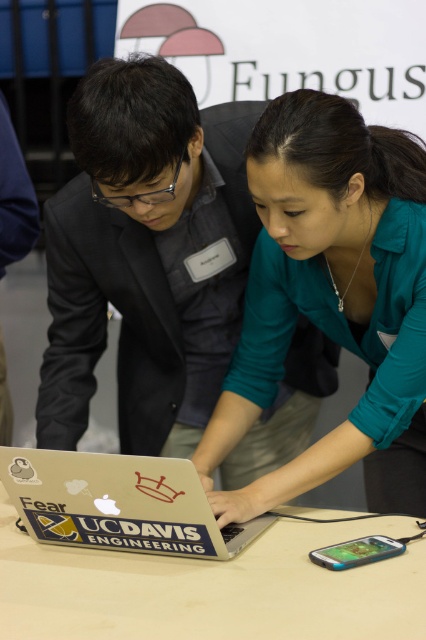
You are a delivery robot with a package that must be placed precisely at point (233, 628). Your current position is 37.70 inches away from that point. Can you reach the point without moving closer than 35 inches?

The distance between your current position and point (233, 628) is 37.70 inches, which is greater than 35 inches. Therefore, you can reach the point without moving closer than 35 inches.

You are a delivery robot with a package that measures 12 inches in length. You need to place it on the white matte table at center without overlapping the silver metallic laptop at center. Is there enough space between them to do this?

The distance between the white matte table at center and the silver metallic laptop at center is 4.82 inches. Since the package is 12 inches long, it would overlap the silver metallic laptop at center if placed there. Choose another location for placement.